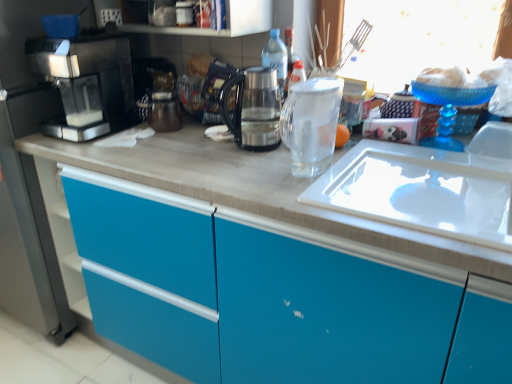
What is the approximate width of metallic black coffee maker at center?

It is 12.55 centimeters.

What do you see at coordinates (421, 191) in the screenshot? This screenshot has width=512, height=384. I see `white glossy sink at center right` at bounding box center [421, 191].

What are the coordinates of `matte white countertop at center` in the screenshot? It's located at (255, 191).

Identify the location of transparent glass coffee pot at center, placed as the 2th kitchen appliance when sorted from right to left. The height and width of the screenshot is (384, 512). (253, 108).

The height and width of the screenshot is (384, 512). What do you see at coordinates (276, 58) in the screenshot?
I see `clear plastic bottle at center` at bounding box center [276, 58].

You are a GUI agent. You are given a task and a screenshot of the screen. Output one action in this format:
    pyautogui.click(x=<x>, y=<y>)
    Task: Click on the sleek black coffee machine at left
    Image resolution: width=512 pixels, height=384 pixels.
    Given the screenshot: What is the action you would take?
    pyautogui.click(x=87, y=83)

Considering the positions of objects clear glass pitcher at center, the 2th kitchen appliance in the left-to-right sequence, and metallic black coffee maker at center in the image provided, who is more to the right, clear glass pitcher at center, the 2th kitchen appliance in the left-to-right sequence, or metallic black coffee maker at center?

clear glass pitcher at center, the 2th kitchen appliance in the left-to-right sequence, is more to the right.

Who is shorter, clear glass pitcher at center, the first kitchen appliance when ordered from right to left, or metallic black coffee maker at center?

With less height is metallic black coffee maker at center.

From a real-world perspective, who is located lower, clear glass pitcher at center, the 2th kitchen appliance in the left-to-right sequence, or metallic black coffee maker at center?

In real-world perspective, clear glass pitcher at center, the 2th kitchen appliance in the left-to-right sequence, is lower.

What are the coordinates of `the 2nd kitchen appliance below when counting from the metallic black coffee maker at center (from the image's perspective)` in the screenshot? It's located at (311, 124).

From a real-world perspective, is white glossy sink at center right positioned over metallic black coffee maker at center based on gravity?

Actually, white glossy sink at center right is physically below metallic black coffee maker at center in the real world.

Is white glossy sink at center right not near metallic black coffee maker at center?

No.

Which is more to the right, white glossy sink at center right or metallic black coffee maker at center?

Positioned to the right is white glossy sink at center right.

Is point (353, 167) in front of point (208, 76)?

That is True.

Would you say matte white countertop at center is inside or outside white glossy sink at center right?

matte white countertop at center is not enclosed by white glossy sink at center right.

Considering the relative sizes of matte white countertop at center and white glossy sink at center right in the image provided, is matte white countertop at center shorter than white glossy sink at center right?

Incorrect, the height of matte white countertop at center does not fall short of that of white glossy sink at center right.

Can you tell me how much matte white countertop at center and white glossy sink at center right differ in facing direction?

The facing directions of matte white countertop at center and white glossy sink at center right are 5.94e-05 degrees apart.

Considering the relative sizes of matte white countertop at center and white glossy sink at center right in the image provided, is matte white countertop at center bigger than white glossy sink at center right?

Yes.

From the image's perspective, is transparent glass coffee pot at center, placed as the first kitchen appliance when sorted from left to right, positioned above or below clear glass pitcher at center, the 2th kitchen appliance in the left-to-right sequence?

Clearly, from the image's perspective, transparent glass coffee pot at center, placed as the first kitchen appliance when sorted from left to right, is above clear glass pitcher at center, the 2th kitchen appliance in the left-to-right sequence.

Looking at their sizes, would you say transparent glass coffee pot at center, placed as the first kitchen appliance when sorted from left to right, is wider or thinner than clear glass pitcher at center, the first kitchen appliance when ordered from right to left?

In the image, transparent glass coffee pot at center, placed as the first kitchen appliance when sorted from left to right, appears to be more narrow than clear glass pitcher at center, the first kitchen appliance when ordered from right to left.

Is point (263, 106) closer or farther from the camera than point (333, 106)?

Clearly, point (263, 106) is more distant from the camera than point (333, 106).

Which object is positioned more to the right, transparent glass coffee pot at center, placed as the 2th kitchen appliance when sorted from right to left, or clear glass pitcher at center, the 2th kitchen appliance in the left-to-right sequence?

clear glass pitcher at center, the 2th kitchen appliance in the left-to-right sequence.

From the image's perspective, is sleek black coffee machine at left located above metallic black coffee maker at center?

No, from the image's perspective, sleek black coffee machine at left is not over metallic black coffee maker at center.

Considering the relative sizes of sleek black coffee machine at left and metallic black coffee maker at center in the image provided, is sleek black coffee machine at left wider than metallic black coffee maker at center?

Yes.

Which is more to the right, sleek black coffee machine at left or metallic black coffee maker at center?

Positioned to the right is metallic black coffee maker at center.

Does point (341, 143) lie in front of point (403, 235)?

No, it is behind (403, 235).

In the image, is transparent glass at center positioned in front of or behind matte white countertop at center?

Visually, transparent glass at center is located behind matte white countertop at center.

Is transparent glass at center placed right next to matte white countertop at center?

They are not placed beside each other.

Between transparent glass at center and matte white countertop at center, which one has more height?

With more height is matte white countertop at center.

In the scene shown: From the image's perspective, is white glossy sink at center right under clear glass pitcher at center, the first kitchen appliance when ordered from right to left?

Yes.

Considering the relative positions of white glossy sink at center right and clear glass pitcher at center, the first kitchen appliance when ordered from right to left, in the image provided, is white glossy sink at center right in front of clear glass pitcher at center, the first kitchen appliance when ordered from right to left,?

Yes, white glossy sink at center right is in front of clear glass pitcher at center, the first kitchen appliance when ordered from right to left.

In terms of width, does white glossy sink at center right look wider or thinner when compared to clear glass pitcher at center, the 2th kitchen appliance in the left-to-right sequence?

In the image, white glossy sink at center right appears to be wider than clear glass pitcher at center, the 2th kitchen appliance in the left-to-right sequence.

Does white glossy sink at center right turn towards clear glass pitcher at center, the first kitchen appliance when ordered from right to left?

No.

Locate an element on the screen. Image resolution: width=512 pixels, height=384 pixels. appliance that is on the left side of clear glass pitcher at center, the 2th kitchen appliance in the left-to-right sequence is located at coordinates (204, 87).

You are a GUI agent. You are given a task and a screenshot of the screen. Output one action in this format:
    pyautogui.click(x=<x>, y=<y>)
    Task: Click on the sink below the metallic black coffee maker at center (from the image's perspective)
    Image resolution: width=512 pixels, height=384 pixels.
    Given the screenshot: What is the action you would take?
    pyautogui.click(x=421, y=191)

Based on their spatial positions, is sleek black coffee machine at left or transparent glass coffee pot at center, placed as the first kitchen appliance when sorted from left to right, closer to white glossy sink at center right?

transparent glass coffee pot at center, placed as the first kitchen appliance when sorted from left to right, is positioned closer to the anchor white glossy sink at center right.

In the scene shown: When comparing their distances from matte white countertop at center, does white glossy sink at center right or clear plastic bottle at center seem closer?

The object closer to matte white countertop at center is white glossy sink at center right.

Based on their spatial positions, is clear glass pitcher at center, the 2th kitchen appliance in the left-to-right sequence, or transparent glass coffee pot at center, placed as the 2th kitchen appliance when sorted from right to left, closer to metallic black coffee maker at center?

transparent glass coffee pot at center, placed as the 2th kitchen appliance when sorted from right to left, is closer to metallic black coffee maker at center.

Based on the photo, which object lies nearer to the anchor point clear plastic bottle at center, metallic black coffee maker at center or clear glass pitcher at center, the 2th kitchen appliance in the left-to-right sequence?

metallic black coffee maker at center is closer to clear plastic bottle at center.

In the scene shown: Which object lies further to the anchor point matte white countertop at center, sleek black coffee machine at left or metallic black coffee maker at center?

The object further to matte white countertop at center is metallic black coffee maker at center.

In the scene shown: Estimate the real-world distances between objects in this image. Which object is closer to transparent glass at center, sleek black coffee machine at left or metallic black coffee maker at center?

Based on the image, metallic black coffee maker at center appears to be nearer to transparent glass at center.

Estimate the real-world distances between objects in this image. Which object is closer to white glossy sink at center right, transparent glass coffee pot at center, placed as the first kitchen appliance when sorted from left to right, or clear plastic bottle at center?

transparent glass coffee pot at center, placed as the first kitchen appliance when sorted from left to right, lies closer to white glossy sink at center right than the other object.

Based on their spatial positions, is clear plastic bottle at center or sleek black coffee machine at left further from transparent glass coffee pot at center, placed as the first kitchen appliance when sorted from left to right?

The object further to transparent glass coffee pot at center, placed as the first kitchen appliance when sorted from left to right, is sleek black coffee machine at left.

Where is `kitchen appliance between clear glass pitcher at center, the 2th kitchen appliance in the left-to-right sequence, and clear plastic bottle at center from front to back`? kitchen appliance between clear glass pitcher at center, the 2th kitchen appliance in the left-to-right sequence, and clear plastic bottle at center from front to back is located at coordinates (253, 108).

Where is `appliance between sleek black coffee machine at left and transparent glass coffee pot at center, placed as the 2th kitchen appliance when sorted from right to left, in the horizontal direction`? The height and width of the screenshot is (384, 512). appliance between sleek black coffee machine at left and transparent glass coffee pot at center, placed as the 2th kitchen appliance when sorted from right to left, in the horizontal direction is located at coordinates (204, 87).

At what (x,y) coordinates should I click in order to perform the action: click on appliance located between white glossy sink at center right and clear plastic bottle at center in the depth direction. Please return your answer as a coordinate pair (x, y). Image resolution: width=512 pixels, height=384 pixels. Looking at the image, I should click on (204, 87).

In order to click on home appliance between metallic black coffee maker at center and matte white countertop at center from top to bottom in this screenshot , I will do `click(87, 83)`.